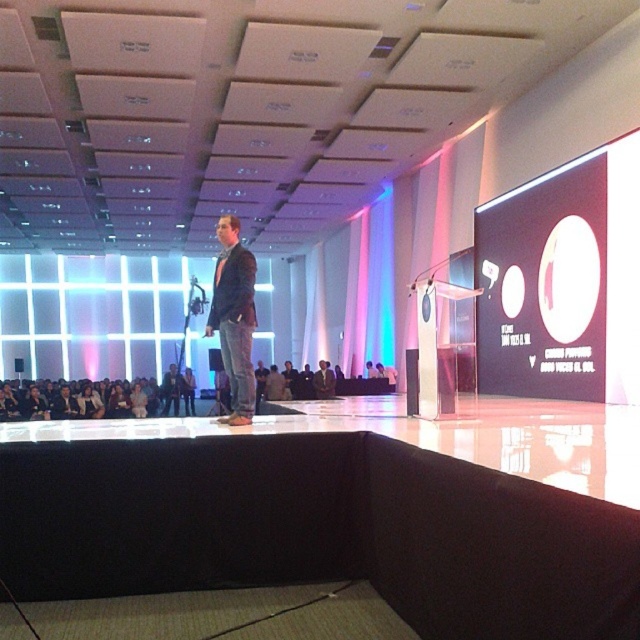
Question: Is matte black circle at upper right positioned at the back of dark blue jeans at center?

Choices:
 (A) yes
 (B) no

Answer: (A)

Question: Is matte black circle at upper right above dark blue jeans at center?

Choices:
 (A) yes
 (B) no

Answer: (A)

Question: Among these objects, which one is nearest to the camera?

Choices:
 (A) dark blue jeans at center
 (B) matte black circle at upper right

Answer: (A)

Question: Among these points, which one is nearest to the camera?

Choices:
 (A) (588, 269)
 (B) (236, 292)

Answer: (B)

Question: Can you confirm if matte black circle at upper right is positioned to the left of dark blue jeans at center?

Choices:
 (A) yes
 (B) no

Answer: (B)